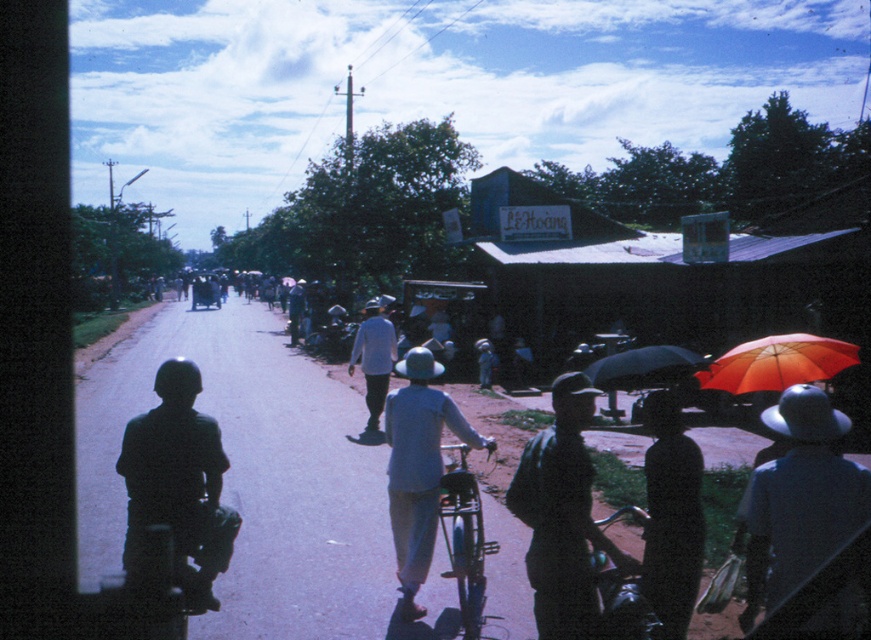
Does point (436, 458) come behind point (585, 372)?

That is True.

Is light blue fabric at center to the left of matte black umbrella at center from the viewer's perspective?

Correct, you'll find light blue fabric at center to the left of matte black umbrella at center.

Image resolution: width=871 pixels, height=640 pixels. Identify the location of light blue fabric at center. (417, 468).

What are the coordinates of `light blue fabric at center` in the screenshot? It's located at (417, 468).

Does dark green helmet at center appear on the right side of black matte hat at lower right?

No, dark green helmet at center is not to the right of black matte hat at lower right.

The width and height of the screenshot is (871, 640). Describe the element at coordinates (179, 483) in the screenshot. I see `dark green helmet at center` at that location.

Locate an element on the screen. The image size is (871, 640). dark green helmet at center is located at coordinates (179, 483).

In order to click on dark green helmet at center in this screenshot , I will do `click(179, 483)`.

Which is more to the left, dark green helmet at center or matte black umbrella at center?

dark green helmet at center is more to the left.

Describe the element at coordinates (179, 483) in the screenshot. The height and width of the screenshot is (640, 871). I see `dark green helmet at center` at that location.

Between point (173, 358) and point (622, 371), which one is positioned in front?

Point (622, 371) is in front.

What are the coordinates of `dark green helmet at center` in the screenshot? It's located at (179, 483).